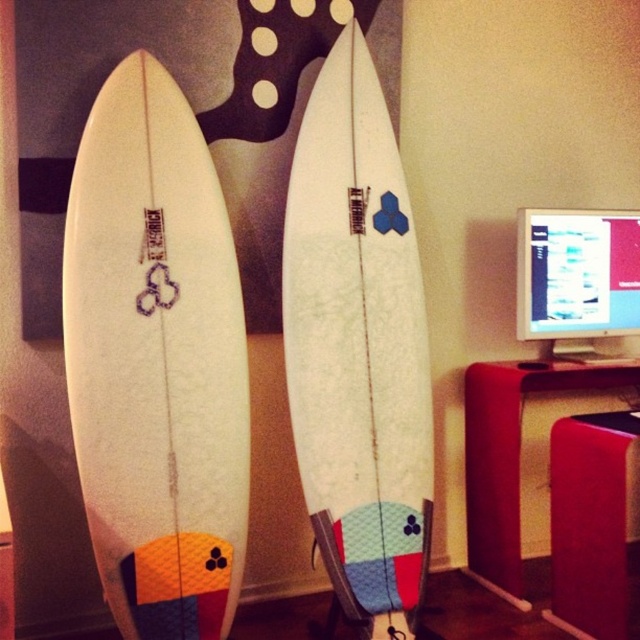
Question: From the image, what is the correct spatial relationship of white matte surfboard at left in relation to white matte surfboard at center?

Choices:
 (A) left
 (B) right

Answer: (A)

Question: Is white matte surfboard at left to the right of matte red desk at lower right from the viewer's perspective?

Choices:
 (A) yes
 (B) no

Answer: (B)

Question: Can you confirm if matte red desk at lower right is wider than matte white monitor at upper right?

Choices:
 (A) yes
 (B) no

Answer: (A)

Question: Estimate the real-world distances between objects in this image. Which object is farther from the white matte surfboard at center?

Choices:
 (A) matte white monitor at upper right
 (B) matte red desk at lower right
 (C) white matte surfboard at left
 (D) matte red stool at lower right

Answer: (A)

Question: Which point is farther to the camera?

Choices:
 (A) matte white monitor at upper right
 (B) white matte surfboard at center
 (C) matte red stool at lower right

Answer: (A)

Question: Which is nearer to the matte red desk at lower right?

Choices:
 (A) white matte surfboard at left
 (B) matte red stool at lower right
 (C) white matte surfboard at center

Answer: (B)